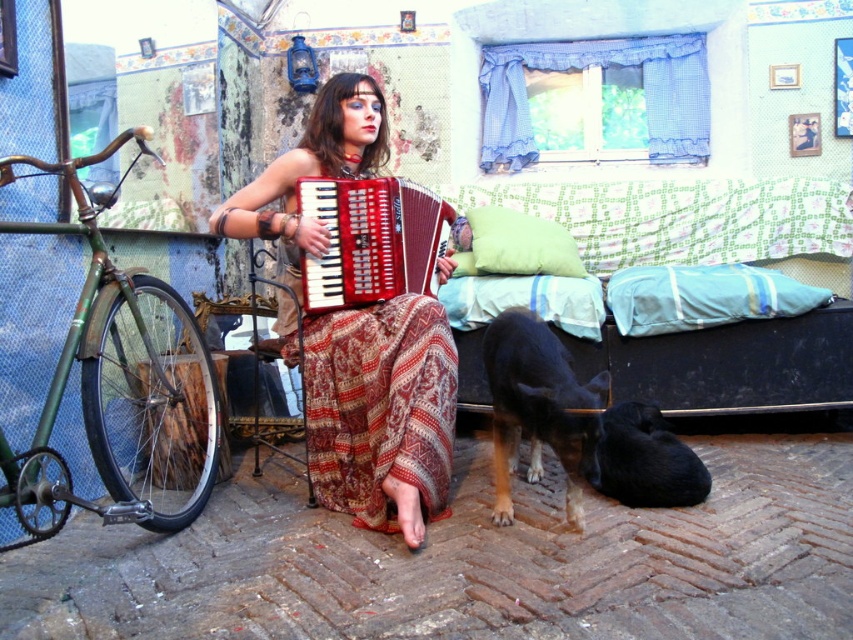
Where is `green matte bicycle at left`? The width and height of the screenshot is (853, 640). green matte bicycle at left is located at coordinates (119, 381).

Based on the photo, does green matte bicycle at left appear on the left side of brown fur dog at lower center?

Indeed, green matte bicycle at left is positioned on the left side of brown fur dog at lower center.

Who is more distant from viewer, (9, 163) or (596, 404)?

Point (596, 404)

Locate an element on the screen. The width and height of the screenshot is (853, 640). green matte bicycle at left is located at coordinates (119, 381).

Which is in front, point (131, 486) or point (450, 480)?

Point (450, 480)

Consider the image. Is green matte bicycle at left behind printed silk skirt at center?

No, it is not.

Locate an element on the screen. green matte bicycle at left is located at coordinates (119, 381).

Who is higher up, red glossy accordion at center or black fur dog at lower right?

red glossy accordion at center is above.

Does red glossy accordion at center have a greater height compared to black fur dog at lower right?

Correct, red glossy accordion at center is much taller as black fur dog at lower right.

Is point (421, 250) more distant than point (618, 426)?

No, (421, 250) is in front of (618, 426).

The width and height of the screenshot is (853, 640). In order to click on red glossy accordion at center in this screenshot , I will do `click(370, 241)`.